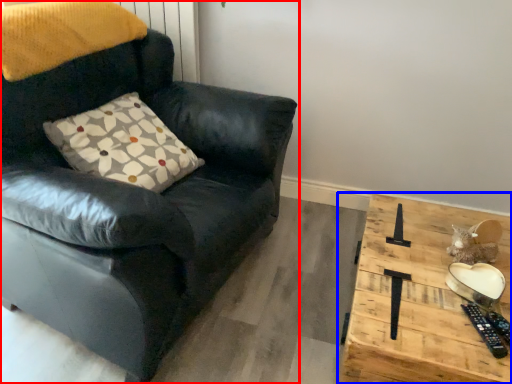
Question: Which object is closer to the camera taking this photo, chair (highlighted by a red box) or table (highlighted by a blue box)?

Choices:
 (A) chair
 (B) table

Answer: (A)